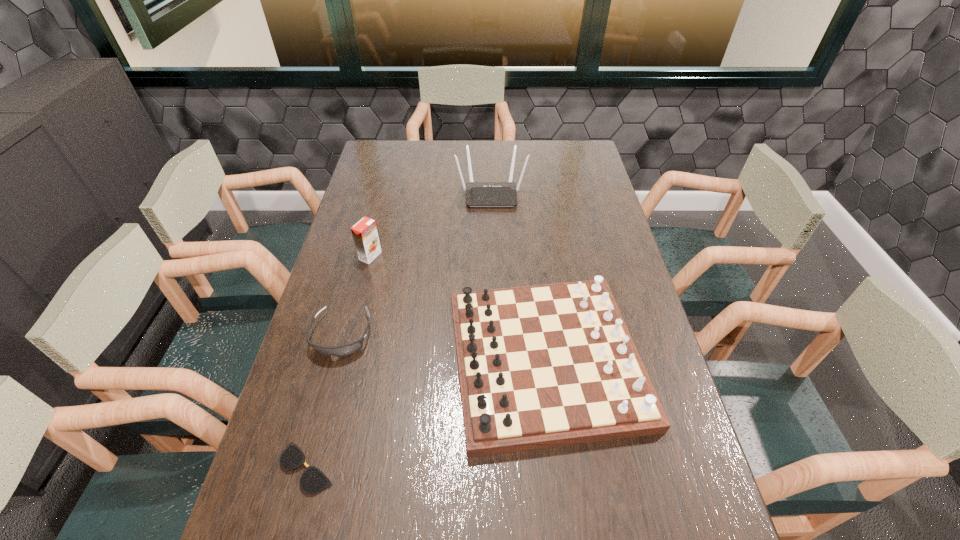
Identify the location of vacant space situated on the lenses of the second shortest object. (293, 518).

The width and height of the screenshot is (960, 540). In order to click on vacant space located 0.220m on the back of the shortest object in this screenshot , I will do click(336, 360).

Find the location of a particular element. orange juice that is at the left edge is located at coordinates (364, 232).

Where is `goggles located in the left edge section of the desktop`? goggles located in the left edge section of the desktop is located at coordinates (345, 350).

Locate an element on the screen. The height and width of the screenshot is (540, 960). spectacles located at the left edge is located at coordinates (312, 481).

What are the coordinates of `object that is positioned at the right edge` in the screenshot? It's located at (540, 366).

The width and height of the screenshot is (960, 540). In order to click on blank space at the far edge of the desktop in this screenshot , I will do `click(506, 140)`.

The height and width of the screenshot is (540, 960). I want to click on free spot at the left edge of the desktop, so click(338, 307).

Locate an element on the screen. free space at the far right corner of the desktop is located at coordinates (557, 152).

This screenshot has width=960, height=540. In order to click on vacant space that's between the chessboard and the fourth tallest object in this screenshot , I will do `click(444, 347)`.